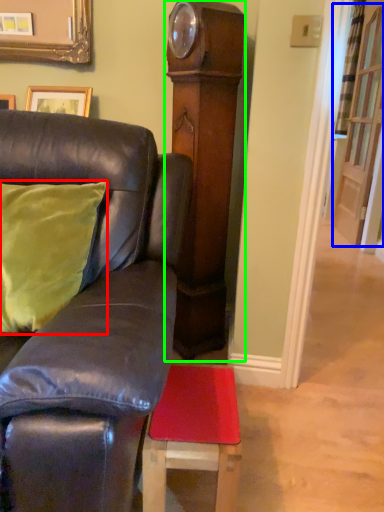
Question: Which is nearer to the pillow (highlighted by a red box)? glass door (highlighted by a blue box) or side (highlighted by a green box).

Choices:
 (A) glass door
 (B) side

Answer: (B)